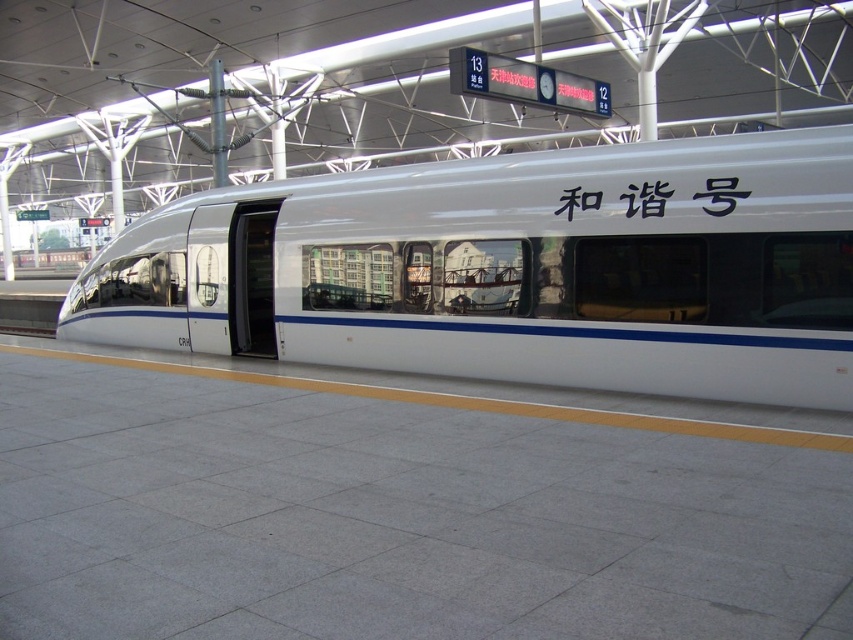
You are a passenger standing on the gray concrete platform at center. You want to board the white glossy train at center. Which direction should you walk to reach the train?

Since the gray concrete platform at center has a smaller size compared to white glossy train at center, you should walk towards the front or back of the platform where the train extends beyond the platform to board the white glossy train at center.

You are standing at the point marked as point (399, 516) in the image. What is the material of the surface you are currently standing on?

The point (399, 516) corresponds to the gray concrete platform at center, so the surface you are standing on is made of concrete.

You are a passenger waiting at the station platform. You want to board the white glossy train at center. Based on its location, where should you position yourself relative to the yellow safety line to board the train safely?

Since the white glossy train at center is located at point (512, 272), you should position yourself along the yellow safety line closest to that coordinate to board the train safely.